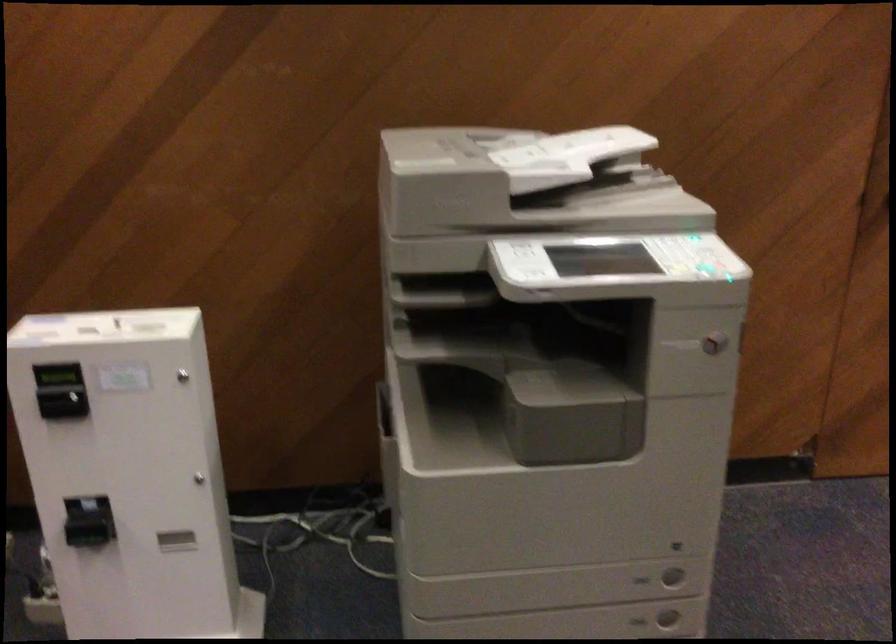
Find where to press the printer control buttons. Please return your answer as a coordinate pair (x, y).

(698, 266)